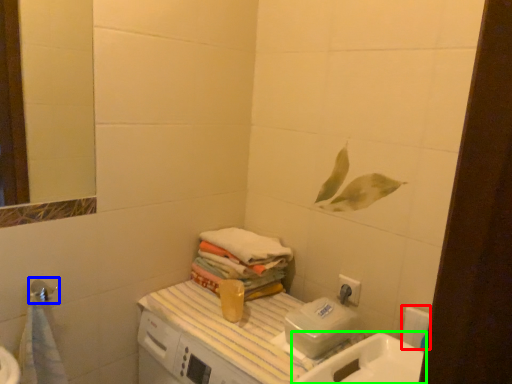
Question: Which object is positioned closest to toilet paper (highlighted by a red box)? Select from shower (highlighted by a blue box) and sink (highlighted by a green box).

Choices:
 (A) shower
 (B) sink

Answer: (B)